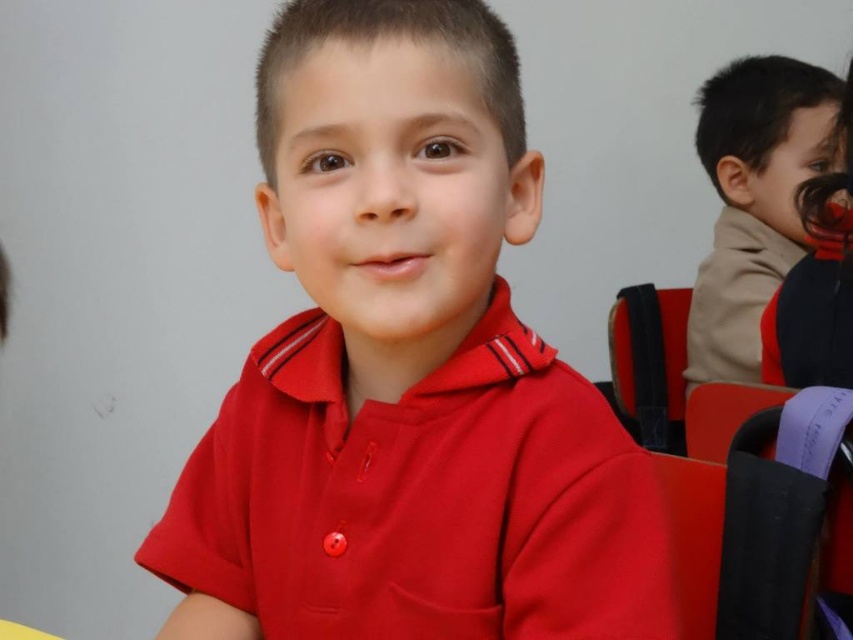
Question: Where is matte red shirt at center located in relation to black fabric chair at right in the image?

Choices:
 (A) left
 (B) right

Answer: (A)

Question: Which point is closer to the camera?

Choices:
 (A) (813, 96)
 (B) (450, 577)
 (C) (637, 403)

Answer: (B)

Question: Where is matte red shirt at center located in relation to black fabric chair at right in the image?

Choices:
 (A) above
 (B) below

Answer: (A)

Question: Considering the real-world distances, which object is closest to the black fabric chair at right?

Choices:
 (A) matte red shirt at center
 (B) brown fuzzy sweater at upper right

Answer: (B)

Question: Is matte red shirt at center above black fabric chair at right?

Choices:
 (A) yes
 (B) no

Answer: (A)

Question: Which is farther from the brown fuzzy sweater at upper right?

Choices:
 (A) matte red shirt at center
 (B) black fabric chair at right

Answer: (A)